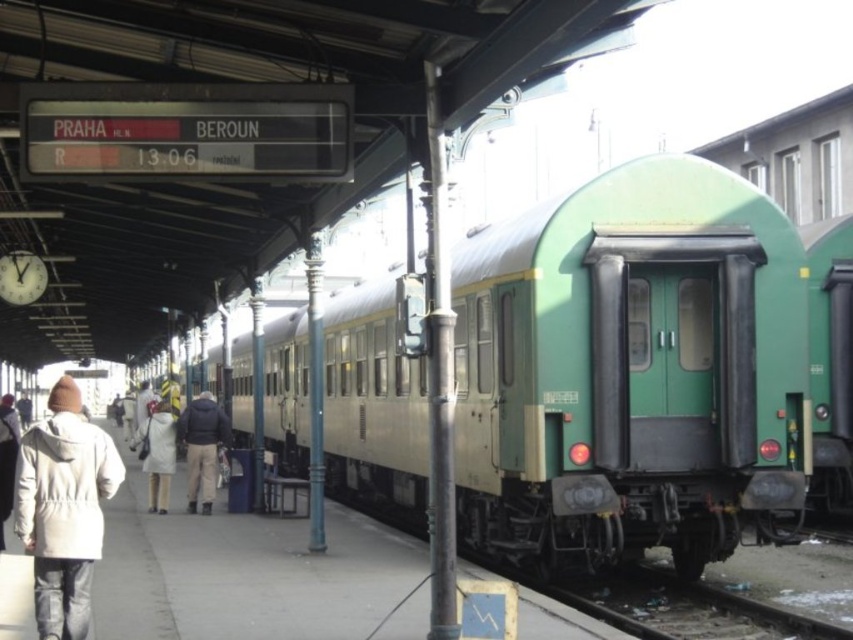
Which is above, white matte coat at left or metal/rough train track at lower right?

white matte coat at left is above.

Consider the image. Is white matte coat at left bigger than metal/rough train track at lower right?

Yes, white matte coat at left is bigger than metal/rough train track at lower right.

Who is more distant from viewer, (88, 529) or (828, 632)?

The point (828, 632) is more distant.

At what (x,y) coordinates should I click in order to perform the action: click on white matte coat at left. Please return your answer as a coordinate pair (x, y). Looking at the image, I should click on (64, 508).

Can you confirm if white matte coat at left is taller than dark blue jacket at center?

Indeed, white matte coat at left has a greater height compared to dark blue jacket at center.

Can you confirm if white matte coat at left is shorter than dark blue jacket at center?

In fact, white matte coat at left may be taller than dark blue jacket at center.

The width and height of the screenshot is (853, 640). In order to click on white matte coat at left in this screenshot , I will do `click(64, 508)`.

Is metal/rough train track at lower right below white woolen hat at upper left?

Yes.

Is metal/rough train track at lower right positioned at the back of white woolen hat at upper left?

Yes, it is behind white woolen hat at upper left.

Where is `metal/rough train track at lower right`? metal/rough train track at lower right is located at coordinates (683, 605).